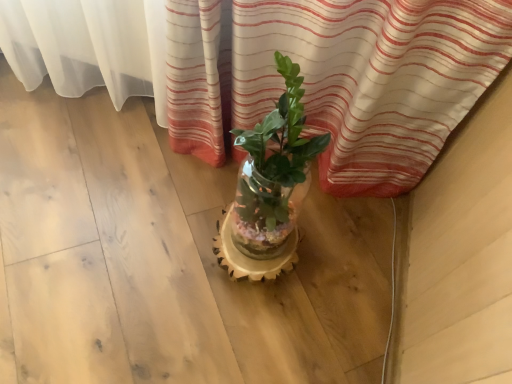
Identify the location of free point to the left of translucent glass vase at center. (172, 234).